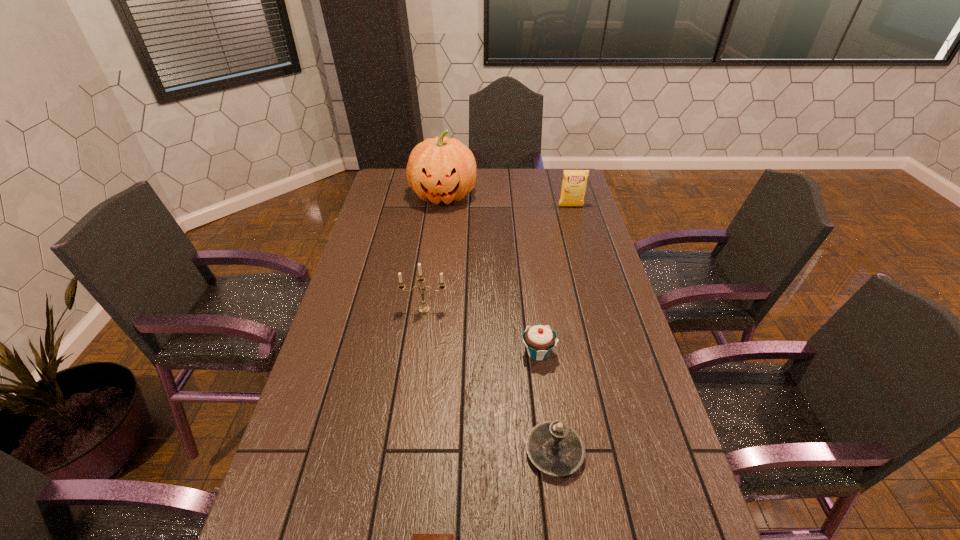
Find the location of a particular element. pumpkin is located at coordinates (441, 169).

Where is `the farther candle`? This screenshot has width=960, height=540. the farther candle is located at coordinates (423, 308).

I want to click on the left candle, so click(423, 308).

Where is `the rightmost object`? This screenshot has width=960, height=540. the rightmost object is located at coordinates (574, 182).

Identify the location of the nearer candle. (555, 448).

This screenshot has width=960, height=540. I want to click on the shorter candle, so click(x=555, y=448).

You are a GUI agent. You are given a task and a screenshot of the screen. Output one action in this format:
    pyautogui.click(x=<x>, y=<y>)
    Task: Click on the second shortest object
    This screenshot has height=540, width=960.
    Given the screenshot: What is the action you would take?
    pyautogui.click(x=539, y=340)

Identify the location of the third nearest object. (539, 340).

Identify the location of vacant space located 0.260m on the carved face of the pumpkin. Image resolution: width=960 pixels, height=540 pixels. (437, 254).

Where is `free region located 0.360m on the right of the third farthest object`? Image resolution: width=960 pixels, height=540 pixels. free region located 0.360m on the right of the third farthest object is located at coordinates (564, 308).